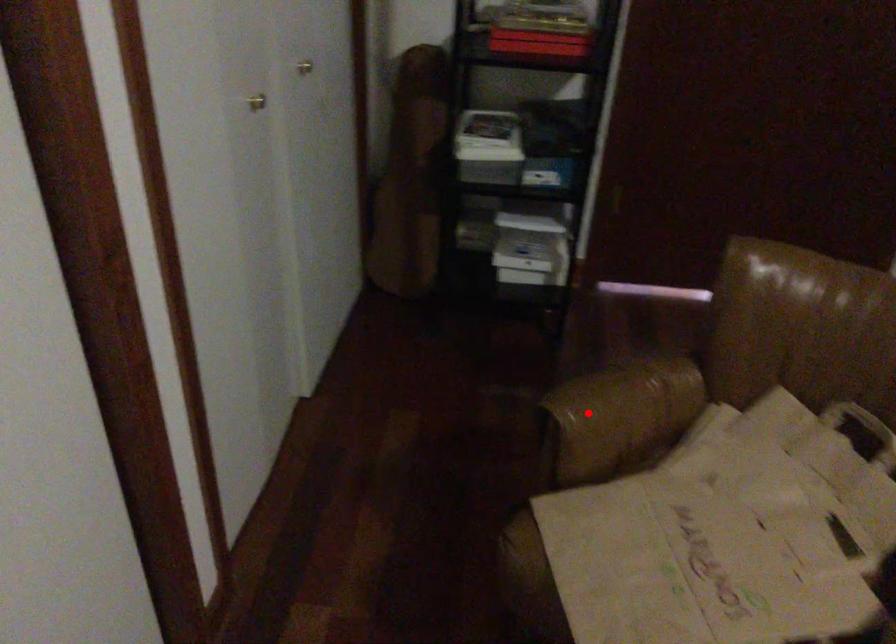
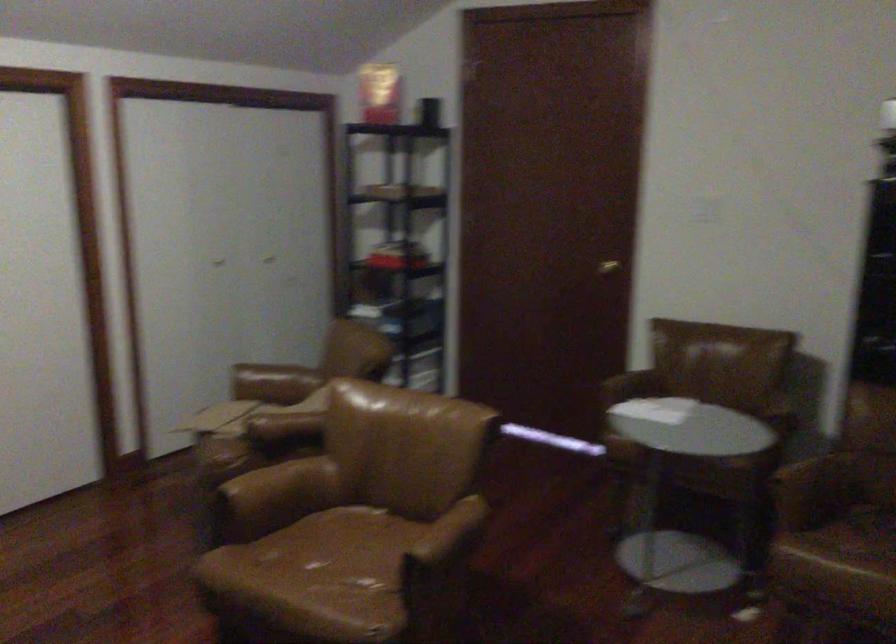
Question: A red point is marked in image1. In image2, is the corresponding 3D point closer to the camera or farther? Reply with the corresponding letter.

Choices:
 (A) The corresponding 3D point is closer.
 (B) The corresponding 3D point is farther.

Answer: (B)